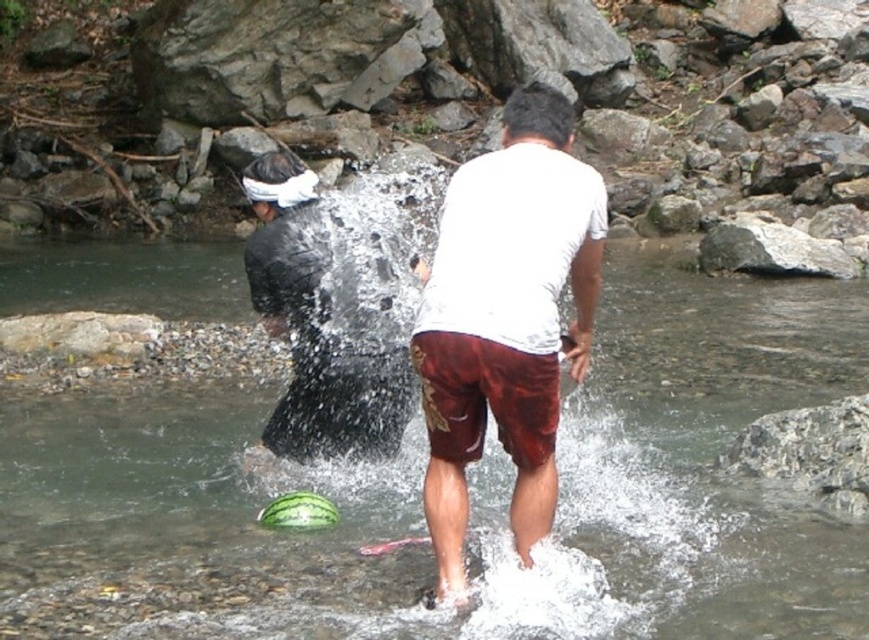
Question: Which point is farther to the camera?

Choices:
 (A) (453, 280)
 (B) (209, 403)

Answer: (B)

Question: Is clear water stream at center below white cotton t-shirt at center?

Choices:
 (A) no
 (B) yes

Answer: (B)

Question: Can you confirm if white cotton t-shirt at center is wider than gray rock at upper center?

Choices:
 (A) yes
 (B) no

Answer: (B)

Question: Estimate the real-world distances between objects in this image. Which object is farther from the clear water stream at center?

Choices:
 (A) white cotton t-shirt at center
 (B) gray rock at upper center

Answer: (A)

Question: Which object is farther from the camera taking this photo?

Choices:
 (A) gray rock at upper center
 (B) clear water stream at center
 (C) white cotton t-shirt at center

Answer: (A)

Question: From the image, what is the correct spatial relationship of clear water stream at center in relation to white cotton t-shirt at center?

Choices:
 (A) above
 (B) below

Answer: (B)